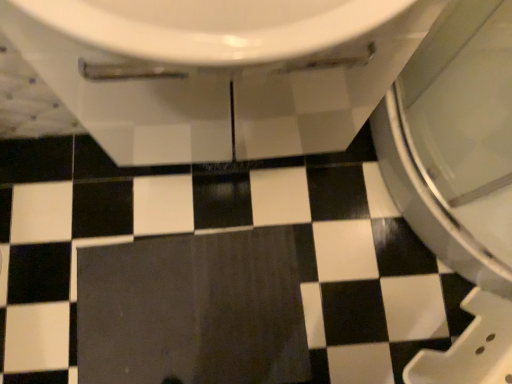
Describe the element at coordinates (218, 71) in the screenshot. This screenshot has height=384, width=512. I see `white glossy toilet at upper center` at that location.

In order to click on white glossy toilet at upper center in this screenshot , I will do `click(218, 71)`.

The width and height of the screenshot is (512, 384). What do you see at coordinates (192, 310) in the screenshot?
I see `dark matte tile at center` at bounding box center [192, 310].

In order to face dark matte tile at center, should I rotate leftwards or rightwards?

You should rotate left by 9.033 degrees.

Where is `dark matte tile at center`? dark matte tile at center is located at coordinates (192, 310).

Where is `white glossy toilet at upper center`? white glossy toilet at upper center is located at coordinates (218, 71).

Is dark matte tile at center at the left side of white glossy toilet at upper center?

Indeed, dark matte tile at center is positioned on the left side of white glossy toilet at upper center.

Considering the relative positions of dark matte tile at center and white glossy toilet at upper center in the image provided, is dark matte tile at center in front of white glossy toilet at upper center?

No, dark matte tile at center is further to the viewer.

Does point (135, 260) appear closer or farther from the camera than point (357, 20)?

Point (135, 260) is farther from the camera than point (357, 20).

From the image's perspective, is dark matte tile at center on white glossy toilet at upper center?

Incorrect, from the image's perspective, dark matte tile at center is lower than white glossy toilet at upper center.

From a real-world perspective, is dark matte tile at center located beneath white glossy toilet at upper center?

Yes, from a real-world perspective, dark matte tile at center is under white glossy toilet at upper center.

Considering the sizes of objects dark matte tile at center and white glossy toilet at upper center in the image provided, who is thinner, dark matte tile at center or white glossy toilet at upper center?

With smaller width is white glossy toilet at upper center.

Considering the sizes of dark matte tile at center and white glossy toilet at upper center in the image, is dark matte tile at center taller or shorter than white glossy toilet at upper center?

Considering their sizes, dark matte tile at center has less height than white glossy toilet at upper center.

Considering the sizes of objects dark matte tile at center and white glossy toilet at upper center in the image provided, who is bigger, dark matte tile at center or white glossy toilet at upper center?

white glossy toilet at upper center.

Is dark matte tile at center surrounding white glossy toilet at upper center?

No, white glossy toilet at upper center is not a part of dark matte tile at center.

Consider the image. Would you consider dark matte tile at center to be distant from white glossy toilet at upper center?

dark matte tile at center is near white glossy toilet at upper center, not far away.

Is dark matte tile at center facing away from white glossy toilet at upper center?

Correct, dark matte tile at center is looking away from white glossy toilet at upper center.

How many degrees apart are the facing directions of dark matte tile at center and white glossy toilet at upper center?

They differ by 2.19 degrees in their facing directions.

Locate an element on the screen. The height and width of the screenshot is (384, 512). toilet lying above the dark matte tile at center (from the image's perspective) is located at coordinates (218, 71).

Which is more to the left, white glossy toilet at upper center or dark matte tile at center?

dark matte tile at center is more to the left.

From the picture: Considering the positions of objects white glossy toilet at upper center and dark matte tile at center in the image provided, who is in front, white glossy toilet at upper center or dark matte tile at center?

white glossy toilet at upper center.

Is point (56, 9) positioned in front of point (268, 297)?

That is True.

From the image's perspective, is white glossy toilet at upper center below dark matte tile at center?

No, from the image's perspective, white glossy toilet at upper center is not below dark matte tile at center.

From a real-world perspective, relative to dark matte tile at center, is white glossy toilet at upper center vertically above or below?

From a real-world perspective, white glossy toilet at upper center is physically above dark matte tile at center.

Which of these two, white glossy toilet at upper center or dark matte tile at center, is wider?

dark matte tile at center is wider.

From their relative heights in the image, would you say white glossy toilet at upper center is taller or shorter than dark matte tile at center?

Result: In the image, white glossy toilet at upper center appears to be taller than dark matte tile at center.

Who is smaller, white glossy toilet at upper center or dark matte tile at center?

dark matte tile at center is smaller.

Is white glossy toilet at upper center outside of dark matte tile at center?

Absolutely, white glossy toilet at upper center is external to dark matte tile at center.

Is white glossy toilet at upper center not near dark matte tile at center?

No, white glossy toilet at upper center is not far away from dark matte tile at center.

Does white glossy toilet at upper center turn towards dark matte tile at center?

Yes, white glossy toilet at upper center is facing dark matte tile at center.

You are a GUI agent. You are given a task and a screenshot of the screen. Output one action in this format:
    pyautogui.click(x=<x>, y=<y>)
    Task: Click on the ceramic tile behind the white glossy toilet at upper center
    
    Given the screenshot: What is the action you would take?
    pos(192,310)

Find the location of `ceramic tile that appears below the white glossy toilet at upper center (from a real-world perspective)`. ceramic tile that appears below the white glossy toilet at upper center (from a real-world perspective) is located at coordinates (192, 310).

In order to click on ceramic tile below the white glossy toilet at upper center (from the image's perspective) in this screenshot , I will do `click(192, 310)`.